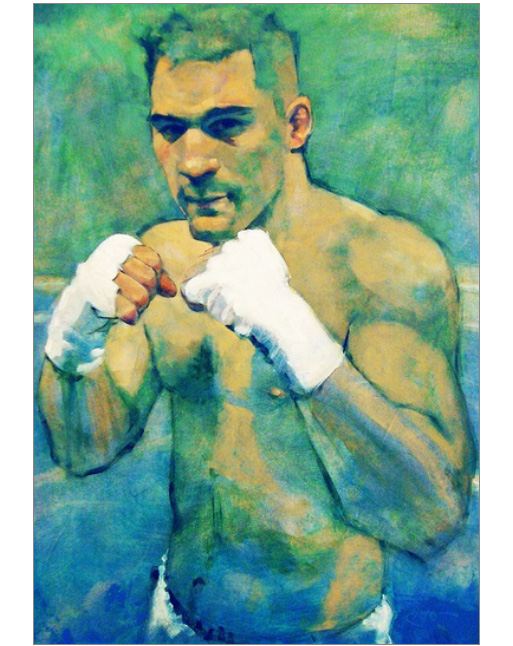
The image size is (513, 646). What are the coordinates of `portrait` in the screenshot? It's located at (314, 41).